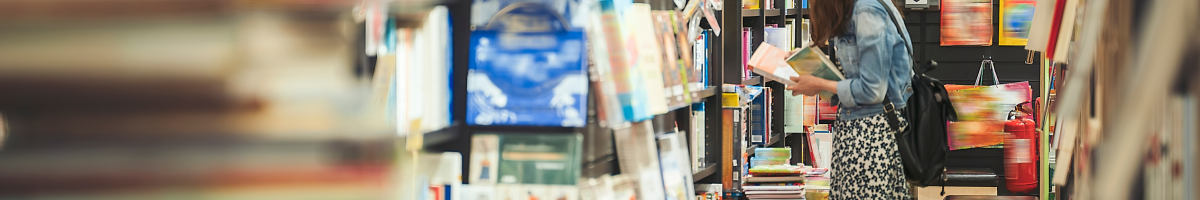
This screenshot has height=200, width=1200. Identify the location of stepstool. (973, 170).